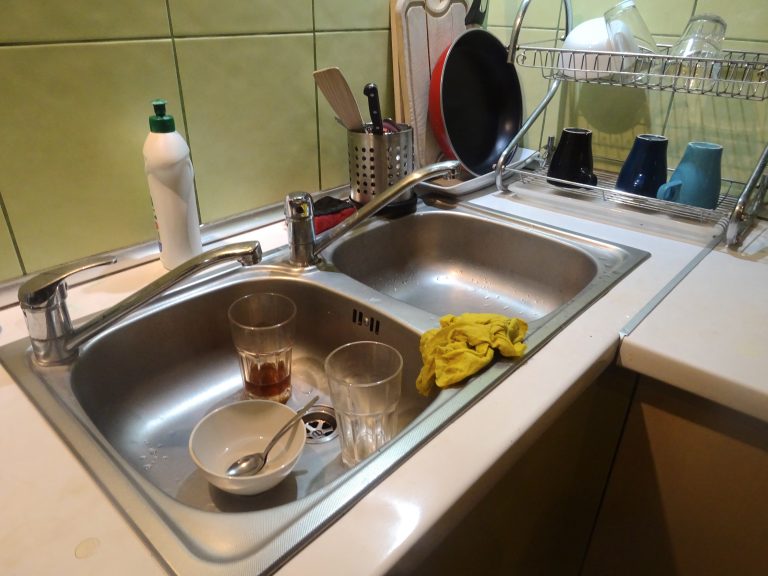
Identify the location of drying rack. (727, 78).